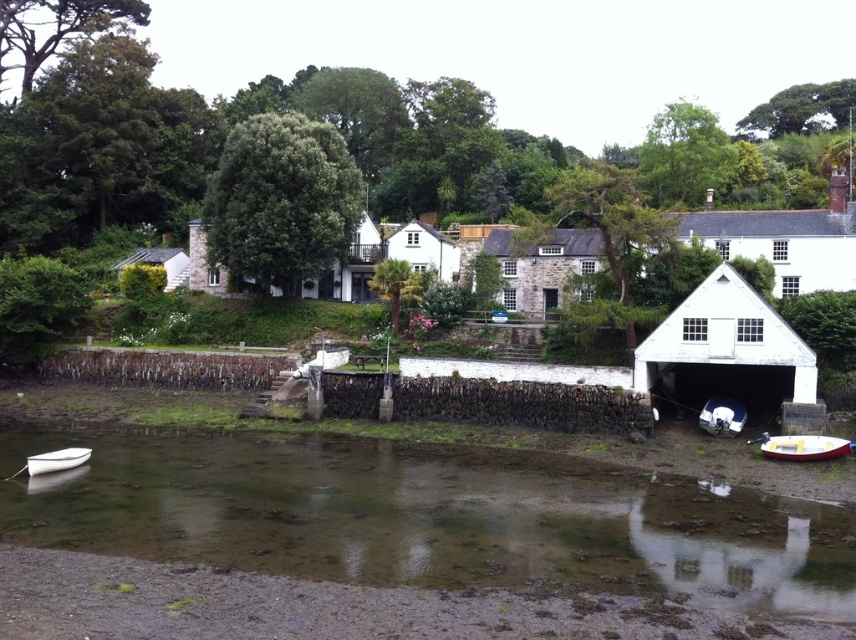
You are planning to transport a large sculpture that requires a boat with a minimum width of 2 meters. You see the white glossy boat at lower right and the white matte boat at lower left. Which boat can accommodate the sculpture based on their widths?

The white glossy boat at lower right has a larger width than the white matte boat at lower left, so it can accommodate the sculpture if its width meets or exceeds 2 meters.

You are standing at the point with coordinates point (316, 484) and want to walk towards the point with coordinates point (67, 454). Which direction should you face to move directly towards your destination?

You should face downward because point (316, 484) is in front of point (67, 454), so moving downward will take you directly towards the destination.

You are standing on the riverside and want to cross to the other side. You see the clear water at lower center and the white matte boat at lower left. Which one should you use to cross the river?

The clear water at lower center is wider than the white matte boat at lower left, so you should use the white matte boat at lower left to cross the river since boats are typically used for crossing water bodies.